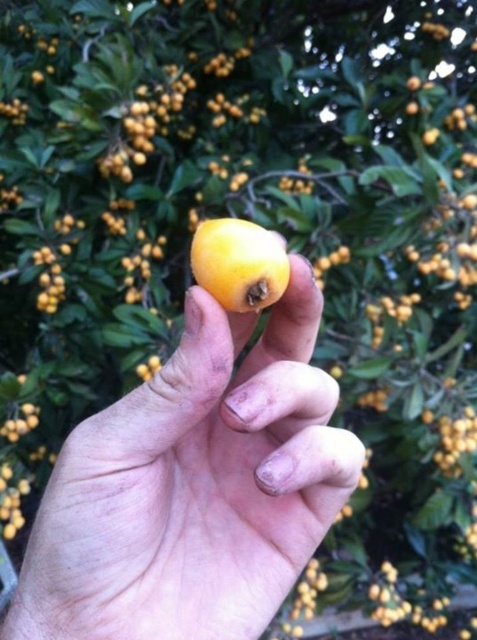
Does point (149, 520) come farther from viewer compared to point (246, 236)?

Yes, it is.

Does yellow matte fruit at center have a lesser height compared to yellow matte/orange at center?

No, yellow matte fruit at center is not shorter than yellow matte/orange at center.

Between point (248, 509) and point (216, 273), which one is positioned behind?

Point (248, 509)

Find the location of a particular element. yellow matte fruit at center is located at coordinates (194, 486).